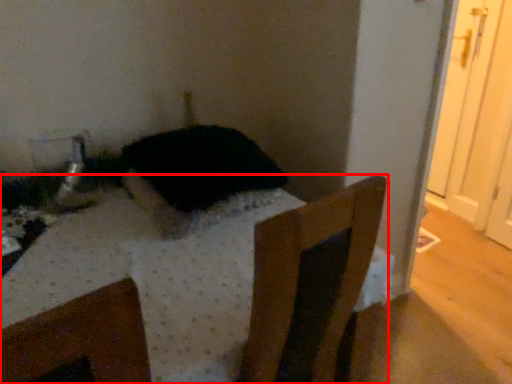
Question: From the image's perspective, considering the relative positions of furniture (annotated by the red box) and animal in the image provided, where is furniture (annotated by the red box) located with respect to the staircase?

Choices:
 (A) above
 (B) below

Answer: (B)